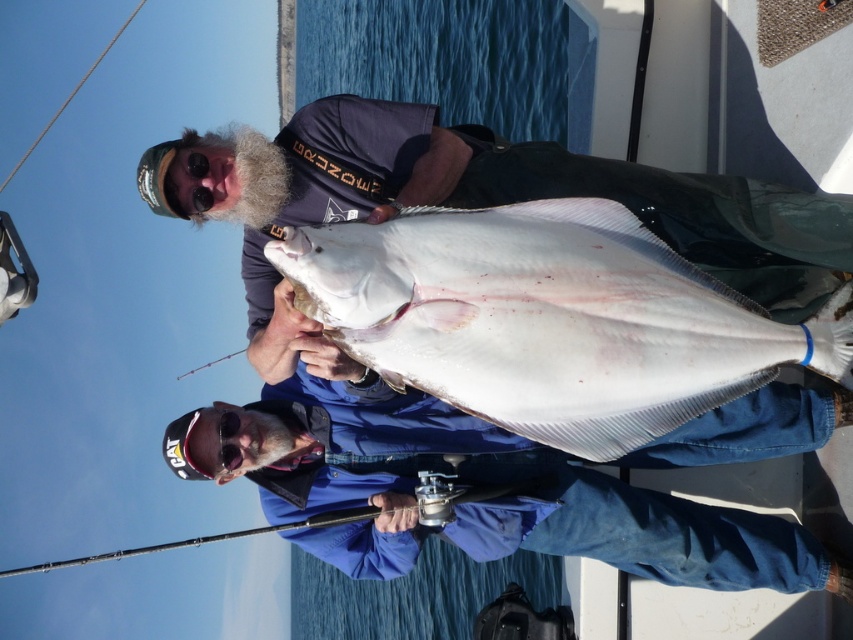
You are standing on the deck of the boat and want to reach the point marked at coordinates (578, 412). If your maximum reach is 5 meters, can you reach it without moving?

The point at coordinates (578, 412) is 4.91 meters away from the camera, so yes, you can reach it since it is within your 5 meter reach.

You are on a boat holding a large fish with two points marked on its body. The points are labeled as point 1 at coordinates (335,144) and point 2 at coordinates (289,529). Which point is closer to you?

Point 1 at coordinates (335,144) is closer to you because it is further to the camera than point 2 at coordinates (289,529).

In the scene shown: You are a photographer trying to capture the white smooth fish at center. The fish is located at coordinates point 0.500, 0.645. If your camera has a zoom lens that can focus on objects within a 0.5 radius from the center point, will the fish be in focus?

The white smooth fish at center is at point (549,320). Since the camera can focus within a 0.5 radius from the center point, the distance from the center to the fish is sqrt of 0.5 squared plus 0.645 squared, which is sqrt of 0.25 plus 0.416, totaling sqrt of 0.666, which is approximately 0.816. This is greater than 0.5, so the fish is outside the focus range and will not be in focus.